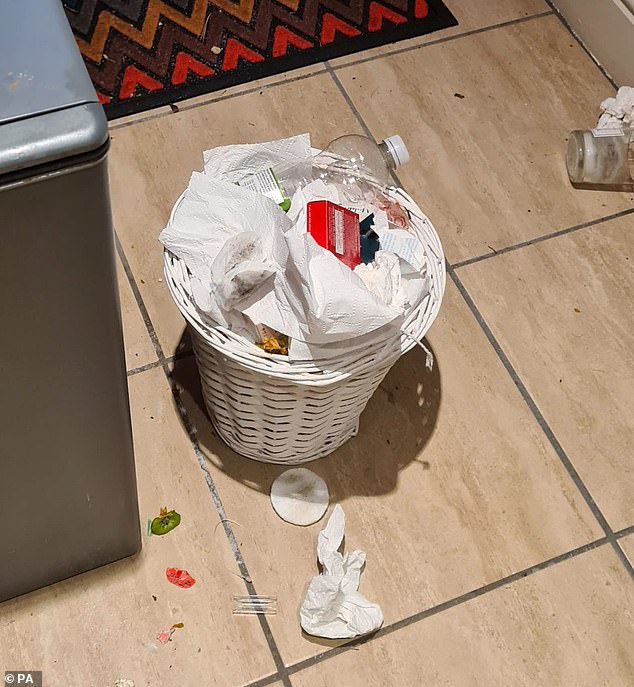
You are a GUI agent. You are given a task and a screenshot of the screen. Output one action in this format:
    pyautogui.click(x=<x>, y=<y>)
    Task: Click on the baseboards
    This screenshot has width=634, height=687.
    Given the screenshot: What is the action you would take?
    pyautogui.click(x=598, y=18)